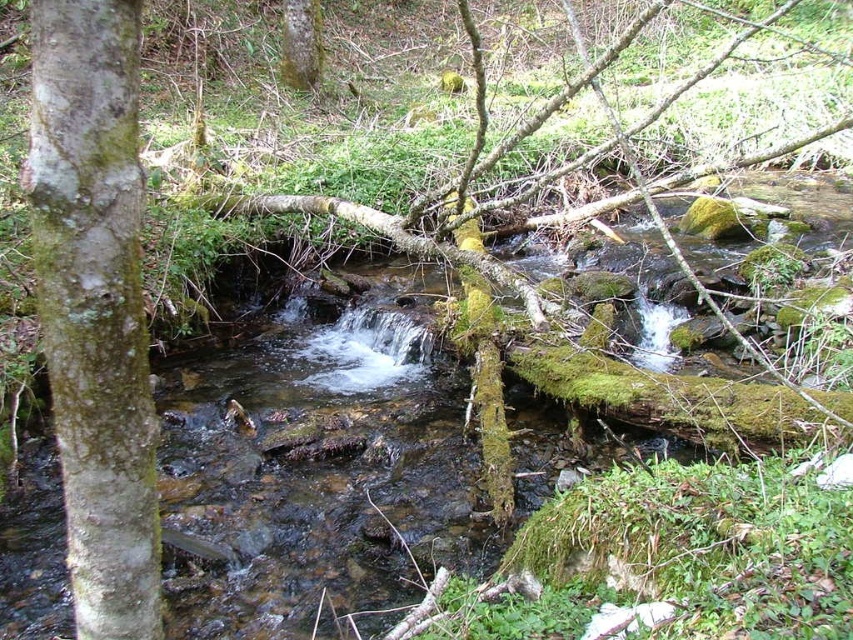
Who is higher up, green mossy bark at left or green mossy tree trunk at upper center?

green mossy tree trunk at upper center is higher up.

Is green mossy bark at left taller than green mossy tree trunk at upper center?

In fact, green mossy bark at left may be shorter than green mossy tree trunk at upper center.

At what (x,y) coordinates should I click in order to perform the action: click on green mossy bark at left. Please return your answer as a coordinate pair (x, y). The width and height of the screenshot is (853, 640). Looking at the image, I should click on (96, 307).